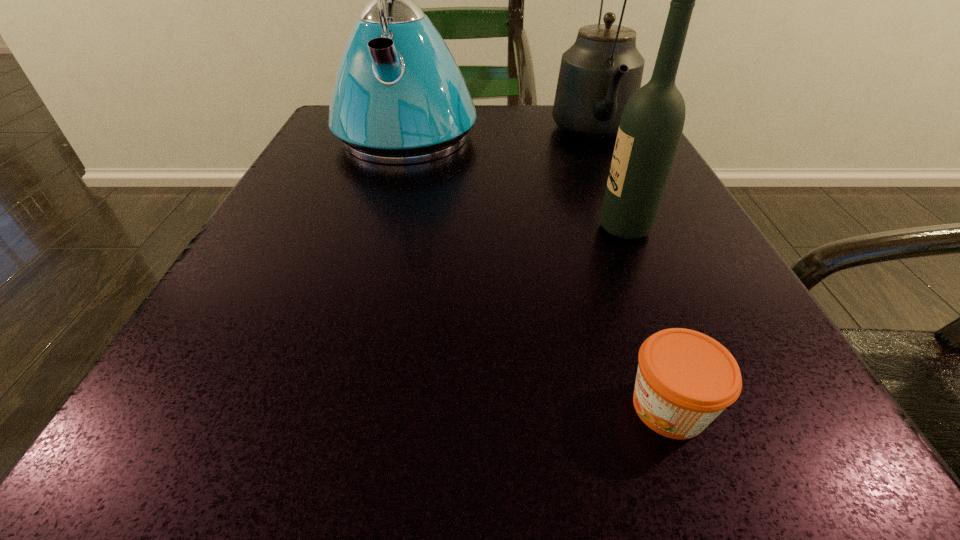
Find the location of a particular element. The image size is (960, 540). vacant region between the left kettle and the right kettle is located at coordinates (500, 134).

At what (x,y) coordinates should I click in order to perform the action: click on vacant space that's between the left kettle and the right kettle. Please return your answer as a coordinate pair (x, y). This screenshot has width=960, height=540. Looking at the image, I should click on (500, 134).

I want to click on free space between the shortest object and the left kettle, so click(538, 270).

Locate an element on the screen. the second closest object to the left kettle is located at coordinates (651, 126).

Locate an element on the screen. The width and height of the screenshot is (960, 540). object that stands as the second closest to the second nearest object is located at coordinates (685, 379).

The width and height of the screenshot is (960, 540). Find the location of `vacant space that satisfies the following two spatial constraints: 1. spout on the right kettle; 2. on the front label of the jam`. vacant space that satisfies the following two spatial constraints: 1. spout on the right kettle; 2. on the front label of the jam is located at coordinates (715, 407).

Find the location of a particular element. This screenshot has height=540, width=960. free space that satisfies the following two spatial constraints: 1. spout on the right kettle; 2. on the labeled side of the third farthest object is located at coordinates (636, 228).